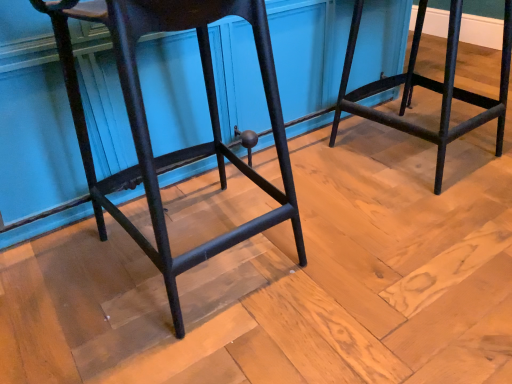
Identify the location of vacant space to the right of matte black stool at center, which is counted as the first furniture, starting from the left. The width and height of the screenshot is (512, 384). (362, 244).